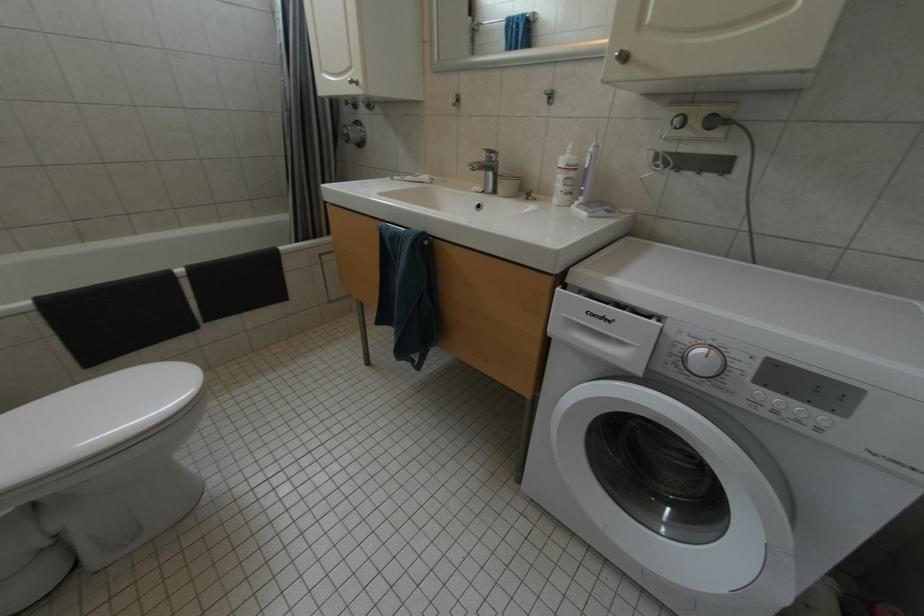
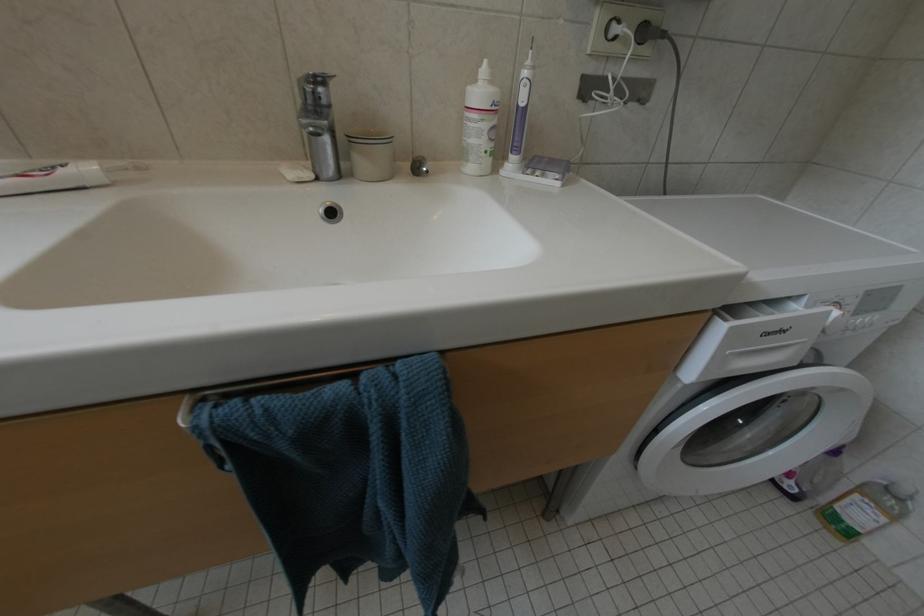
The images are taken continuously from a first-person perspective. In which direction is your viewpoint rotating?

The rotation direction of the camera is right-down.